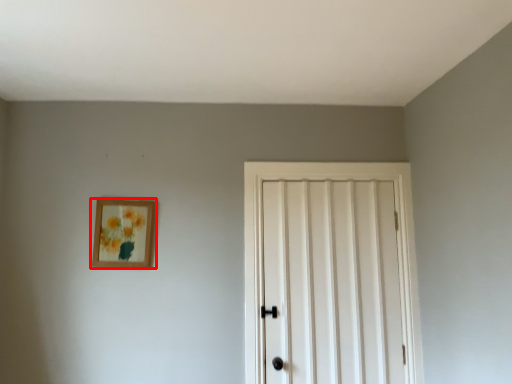
Question: In this image, where is picture frame (annotated by the red box) located relative to door?

Choices:
 (A) right
 (B) left

Answer: (B)